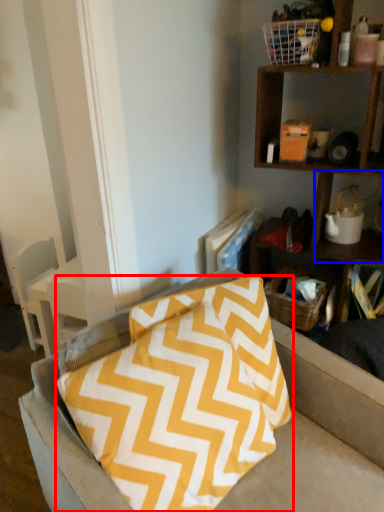
Question: Which point is closer to the camera, pillow (highlighted by a red box) or cabinet (highlighted by a blue box)?

Choices:
 (A) pillow
 (B) cabinet

Answer: (A)